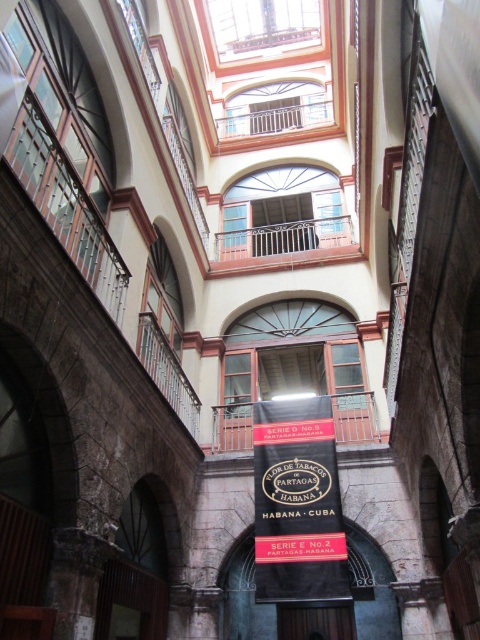
You are standing in the historic building and want to locate the black fabric banner at center. According to the coordinates provided, where should you look to find it?

The black fabric banner at center is located at point (296, 483), so you should look towards that coordinate to find it.

You are standing in the historic building and want to find the bronze sign at center. Based on the coordinates provided, can you determine its position relative to the center of the atrium?

The bronze sign at center is located at coordinates point (x=371, y=588), which means it is positioned slightly to the right and below the center of the atrium.